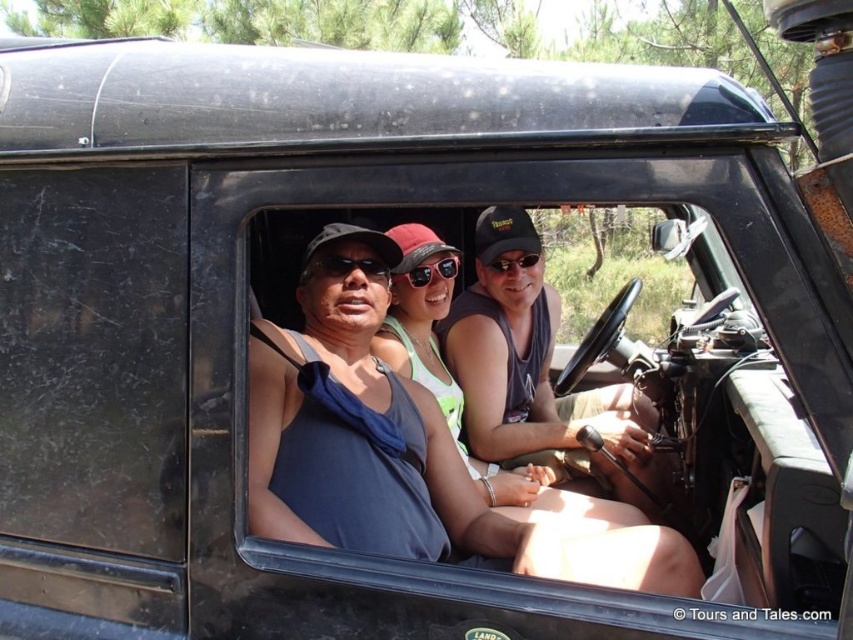
Describe the element at coordinates (531, 368) in the screenshot. I see `matte black tank top at center` at that location.

Is matte black tank top at center closer to camera compared to black plastic sunglasses at center?

No, it is behind black plastic sunglasses at center.

Does point (477, 403) come in front of point (413, 276)?

No.

Locate an element on the screen. matte black tank top at center is located at coordinates (x=531, y=368).

Can you confirm if matte black tank top at center is positioned to the right of matte black sunglasses at center?

Correct, you'll find matte black tank top at center to the right of matte black sunglasses at center.

Does matte black tank top at center appear over matte black sunglasses at center?

Actually, matte black tank top at center is below matte black sunglasses at center.

You are a GUI agent. You are given a task and a screenshot of the screen. Output one action in this format:
    pyautogui.click(x=<x>, y=<y>)
    Task: Click on the matte black tank top at center
    This screenshot has width=853, height=640.
    Given the screenshot: What is the action you would take?
    pyautogui.click(x=531, y=368)

Identify the location of matte black tank top at center. The height and width of the screenshot is (640, 853). (531, 368).

Who is higher up, black plastic sunglasses at center or matte black sunglasses at center?

matte black sunglasses at center is higher up.

What are the coordinates of `black plastic sunglasses at center` in the screenshot? It's located at (431, 272).